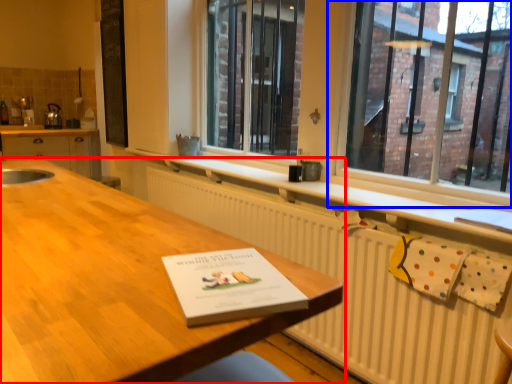
Question: Among these objects, which one is farthest to the camera, table (highlighted by a red box) or window (highlighted by a blue box)?

Choices:
 (A) table
 (B) window

Answer: (B)